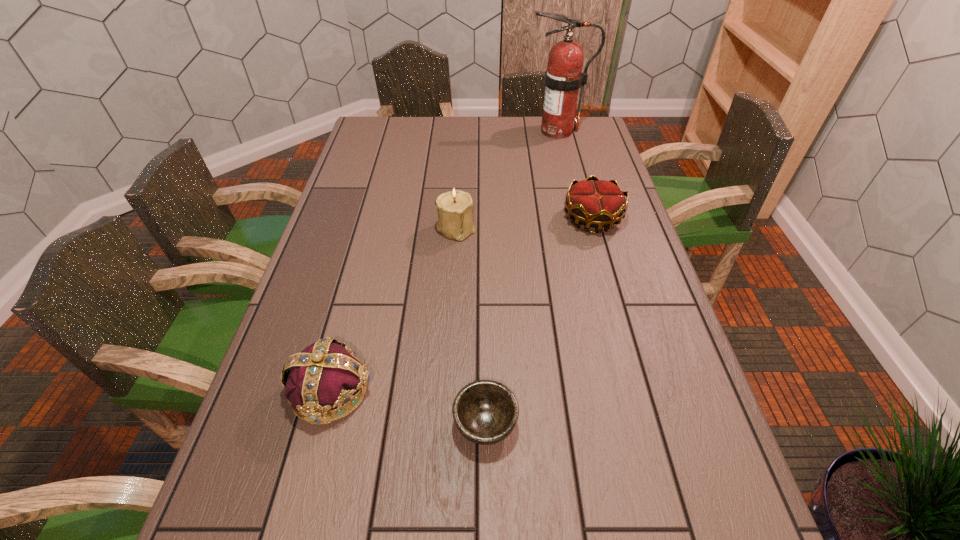
Where is `the farthest object`? The width and height of the screenshot is (960, 540). the farthest object is located at coordinates (563, 78).

Locate an element on the screen. This screenshot has height=540, width=960. the tallest object is located at coordinates (563, 78).

You are a GUI agent. You are given a task and a screenshot of the screen. Output one action in this format:
    pyautogui.click(x=<x>, y=<y>)
    Task: Click on the candle_holder
    Image resolution: width=960 pixels, height=540 pixels.
    Given the screenshot: What is the action you would take?
    pyautogui.click(x=455, y=208)

I want to click on the nearer crown, so click(327, 374).

Where is `the third tallest object`? This screenshot has height=540, width=960. the third tallest object is located at coordinates [x=327, y=374].

Find the location of a particular element. The image size is (960, 540). the fourth tallest object is located at coordinates (597, 203).

Identify the location of the right crown. The height and width of the screenshot is (540, 960). (597, 203).

In order to click on bowl in this screenshot , I will do `click(485, 412)`.

The width and height of the screenshot is (960, 540). I want to click on vacant region located at the nozzle of the farthest object, so click(x=485, y=131).

Image resolution: width=960 pixels, height=540 pixels. I want to click on vacant space located 0.210m at the nozzle of the farthest object, so click(472, 131).